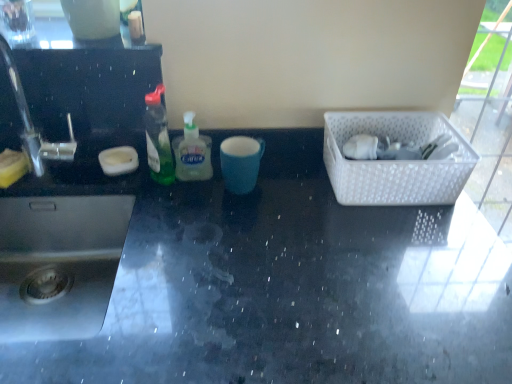
This screenshot has height=384, width=512. I want to click on free space to the right of green translucent bottle at center, placed as the first bottle when sorted from left to right, so click(x=237, y=192).